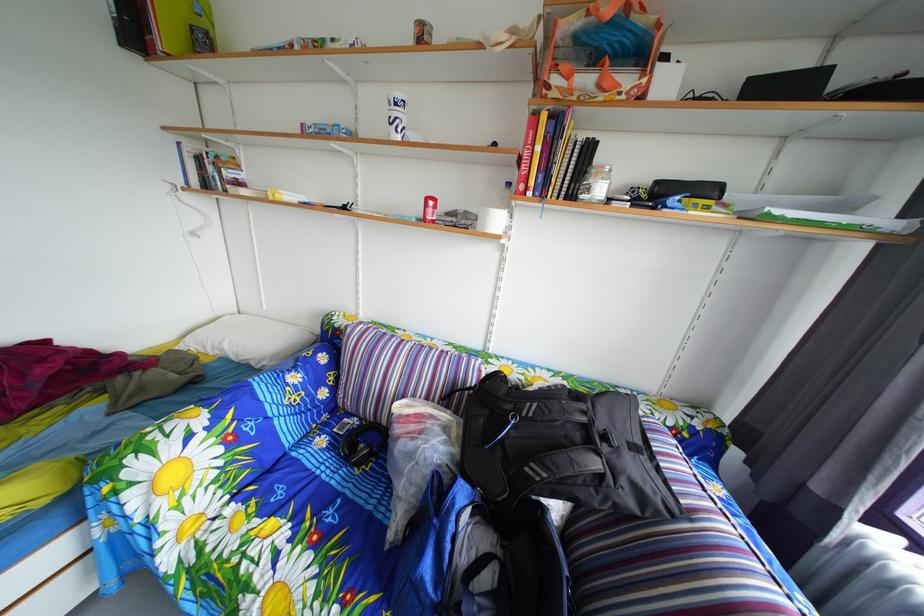
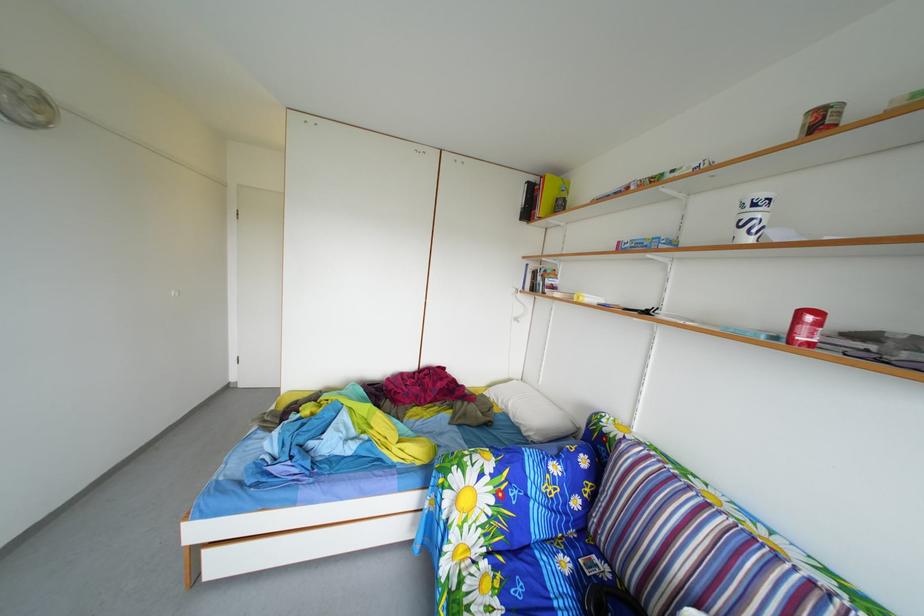
Question: How did the camera likely rotate?

Choices:
 (A) Left
 (B) Right
 (C) Up
 (D) Down

Answer: (A)